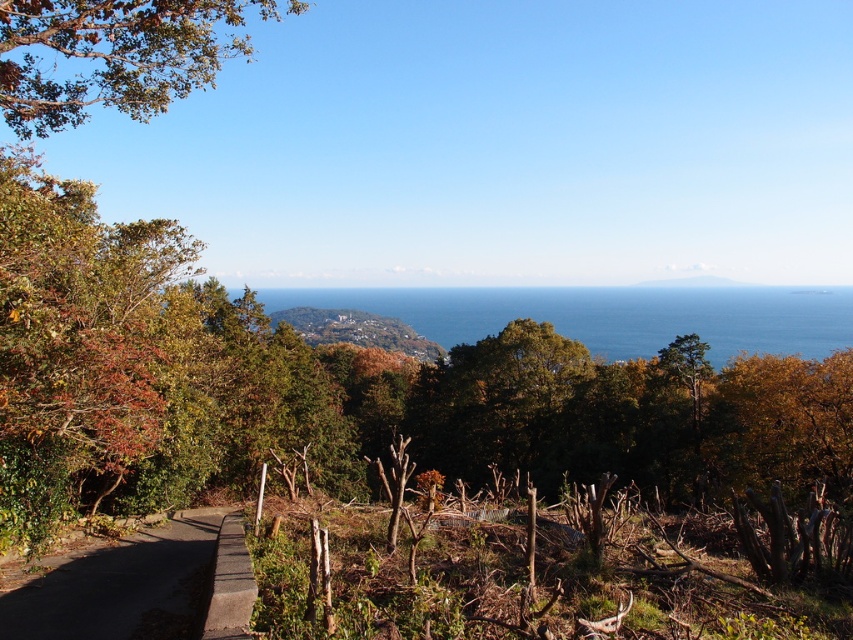
You are standing on the concrete path at lower left and want to reach the green grassy hillside at center. Which direction should you walk to get there?

To reach the green grassy hillside at center from the concrete path at lower left, you should walk to the left since the green grassy hillside at center is located to the left of the concrete path at lower left.

You are standing at the point closer to the camera between the two points, point (28, 604) and point (225, 525). Which point are you standing at?

You are standing at point (28, 604) because it is further to the camera than point (225, 525).

You are a hiker standing at the start of the gray concrete path at lower left. You want to walk along the path to reach a viewpoint further ahead. As you begin walking, which direction should you turn to first avoid the green leafy tree at upper left blocking your view?

You should turn to the right to avoid the green leafy tree at upper left, as the gray concrete path at lower left is behind the tree, meaning the path curves away from it to the right.